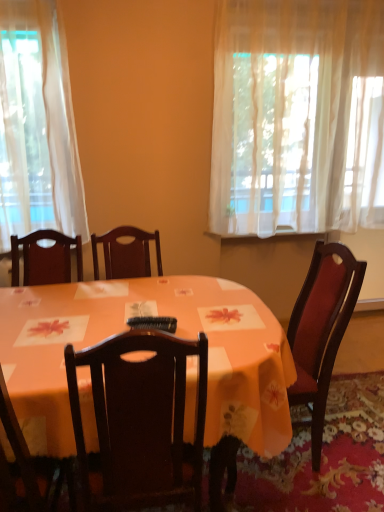
Question: Is wooden chair at lower left far away from orange fabric table at center?

Choices:
 (A) no
 (B) yes

Answer: (A)

Question: Is the position of wooden chair at lower left more distant than that of orange fabric table at center?

Choices:
 (A) yes
 (B) no

Answer: (B)

Question: Does wooden chair at lower left touch orange fabric table at center?

Choices:
 (A) yes
 (B) no

Answer: (B)

Question: From the image's perspective, does wooden chair at lower left appear higher than orange fabric table at center?

Choices:
 (A) no
 (B) yes

Answer: (A)

Question: Is wooden chair at lower left at the right side of orange fabric table at center?

Choices:
 (A) no
 (B) yes

Answer: (A)

Question: Can you confirm if wooden chair at lower left is positioned to the left of orange fabric table at center?

Choices:
 (A) no
 (B) yes

Answer: (B)

Question: Does black plastic remote control at center have a greater width compared to orange fabric table at center?

Choices:
 (A) no
 (B) yes

Answer: (A)

Question: Is black plastic remote control at center oriented away from orange fabric table at center?

Choices:
 (A) yes
 (B) no

Answer: (A)

Question: Does black plastic remote control at center appear on the right side of orange fabric table at center?

Choices:
 (A) no
 (B) yes

Answer: (B)

Question: From a real-world perspective, is black plastic remote control at center under orange fabric table at center?

Choices:
 (A) yes
 (B) no

Answer: (B)

Question: Does black plastic remote control at center have a greater height compared to orange fabric table at center?

Choices:
 (A) no
 (B) yes

Answer: (A)

Question: From the image's perspective, is black plastic remote control at center above orange fabric table at center?

Choices:
 (A) yes
 (B) no

Answer: (A)

Question: Is sheer white curtain at upper right to the left of black plastic remote control at center from the viewer's perspective?

Choices:
 (A) no
 (B) yes

Answer: (A)